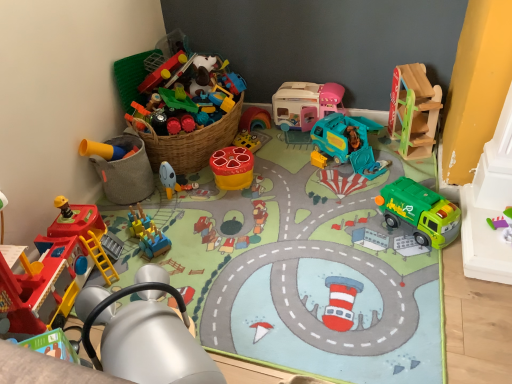
You are a GUI agent. You are given a task and a screenshot of the screen. Output one action in this format:
    pyautogui.click(x=<x>, y=<y>)
    Task: Click on the vacant area that lies between pastel pink plastic camper at center, marked as the sixth toy in a left-to-right arrangement, and matte plastic stool at center, the fifth toy from the left
    The width and height of the screenshot is (512, 384).
    Given the screenshot: What is the action you would take?
    pyautogui.click(x=278, y=150)